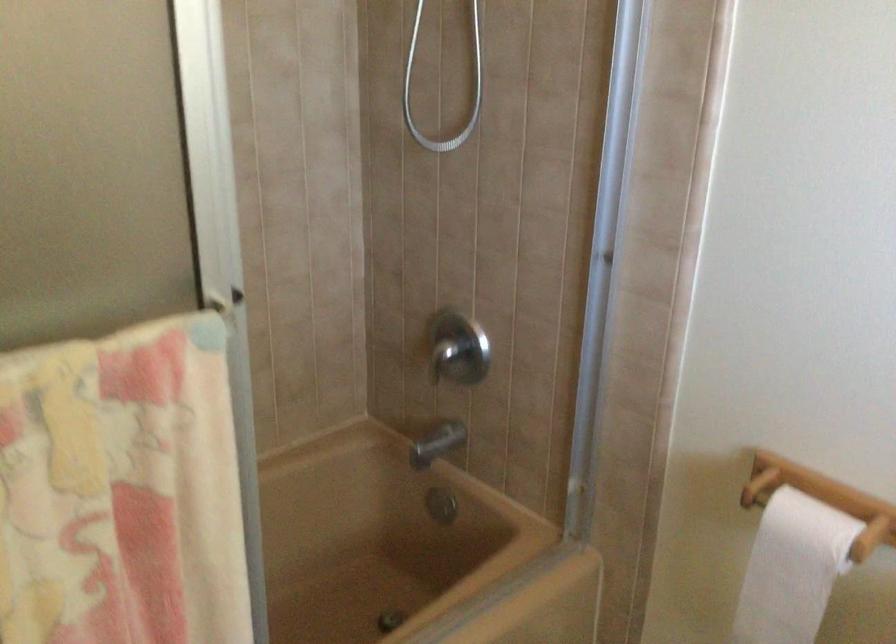
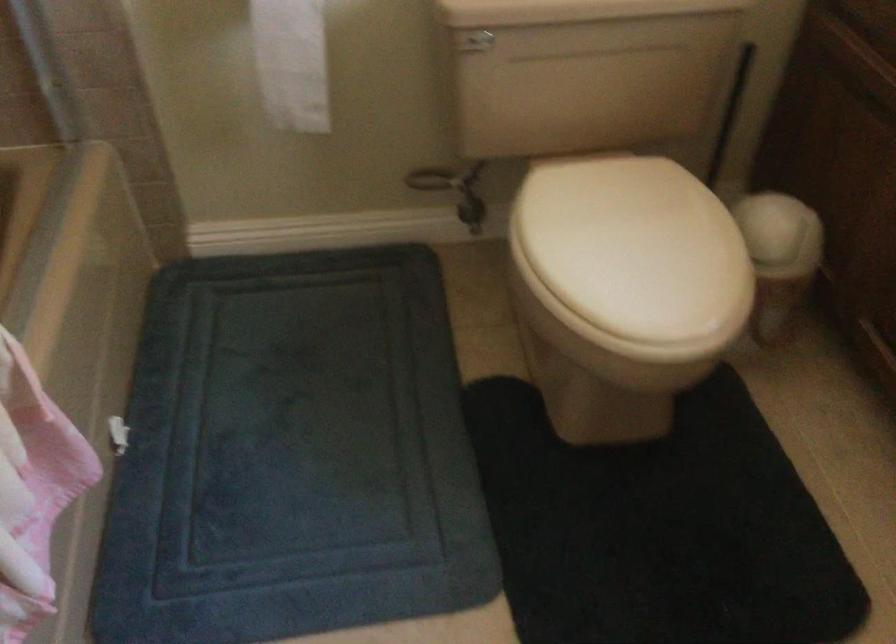
The first image is from the beginning of the video and the second image is from the end. How did the camera likely rotate when shooting the video?

The camera's rotation is toward right-down.